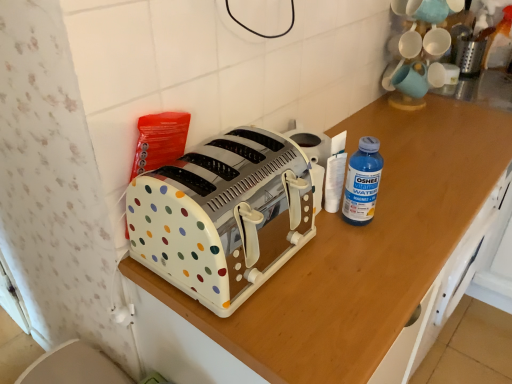
In order to face white polka dot plastic toaster at center, should I rotate leftwards or rightwards?

You should rotate left by 3.700 degrees.

This screenshot has width=512, height=384. What do you see at coordinates (362, 182) in the screenshot?
I see `blue plastic bottle at right` at bounding box center [362, 182].

Where is `white polka dot plastic toaster at center`? Image resolution: width=512 pixels, height=384 pixels. white polka dot plastic toaster at center is located at coordinates (223, 216).

Would you say blue plastic bottle at right contains metallic silver grater at upper right?

No, metallic silver grater at upper right is not a part of blue plastic bottle at right.

From their relative heights in the image, would you say blue plastic bottle at right is taller or shorter than metallic silver grater at upper right?

Considering their sizes, blue plastic bottle at right has more height than metallic silver grater at upper right.

In the scene shown: Considering the sizes of objects blue plastic bottle at right and metallic silver grater at upper right in the image provided, who is wider, blue plastic bottle at right or metallic silver grater at upper right?

metallic silver grater at upper right is wider.

Between blue plastic bottle at right and metallic silver grater at upper right, which one has smaller size?

With smaller size is blue plastic bottle at right.

Is the surface of white plastic toaster at center in direct contact with white polka dot plastic toaster at center?

No, white plastic toaster at center is not next to white polka dot plastic toaster at center.

From a real-world perspective, between white plastic toaster at center and white polka dot plastic toaster at center, who is vertically lower?

From a 3D spatial view, white plastic toaster at center is below.

Considering the relative sizes of white plastic toaster at center and white polka dot plastic toaster at center in the image provided, is white plastic toaster at center wider than white polka dot plastic toaster at center?

Yes.

Can you tell me how much blue plastic bottle at right and white polka dot plastic toaster at center differ in facing direction?

The angle between the facing direction of blue plastic bottle at right and the facing direction of white polka dot plastic toaster at center is 2.05 degrees.

From a real-world perspective, which is physically above, blue plastic bottle at right or white polka dot plastic toaster at center?

white polka dot plastic toaster at center is physically above.

Does blue plastic bottle at right appear on the left side of white polka dot plastic toaster at center?

In fact, blue plastic bottle at right is to the right of white polka dot plastic toaster at center.

Is white polka dot plastic toaster at center completely or partially inside blue plastic bottle at right?

No.

Between blue plastic bottle at right and white plastic toaster at center, which one has larger width?

With larger width is white plastic toaster at center.

How different are the orientations of blue plastic bottle at right and white plastic toaster at center in degrees?

The facing directions of blue plastic bottle at right and white plastic toaster at center are 0.64 degrees apart.

Which is more to the right, blue plastic bottle at right or white plastic toaster at center?

Positioned to the right is blue plastic bottle at right.

Could you tell me if blue plastic bottle at right is turned towards white plastic toaster at center?

No, blue plastic bottle at right is not facing towards white plastic toaster at center.

Is metallic silver grater at upper right next to blue plastic bottle at right?

metallic silver grater at upper right and blue plastic bottle at right are not in contact.

Considering the sizes of metallic silver grater at upper right and blue plastic bottle at right in the image, is metallic silver grater at upper right wider or thinner than blue plastic bottle at right?

Clearly, metallic silver grater at upper right has more width compared to blue plastic bottle at right.

Is point (456, 56) closer to viewer compared to point (376, 153)?

No, (456, 56) is further to viewer.

Considering the relative positions of metallic silver grater at upper right and blue plastic bottle at right in the image provided, is metallic silver grater at upper right to the right of blue plastic bottle at right from the viewer's perspective?

Correct, you'll find metallic silver grater at upper right to the right of blue plastic bottle at right.

Is metallic silver grater at upper right positioned behind white polka dot plastic toaster at center?

Yes, it is.

Between metallic silver grater at upper right and white polka dot plastic toaster at center, which one has larger size?

white polka dot plastic toaster at center.

Which object is positioned more to the right, metallic silver grater at upper right or white polka dot plastic toaster at center?

metallic silver grater at upper right is more to the right.

From their relative heights in the image, would you say metallic silver grater at upper right is taller or shorter than white polka dot plastic toaster at center?

Clearly, metallic silver grater at upper right is shorter compared to white polka dot plastic toaster at center.

Which is nearer, (138, 249) or (398, 115)?

Point (138, 249).

Is white polka dot plastic toaster at center aimed at white plastic toaster at center?

No, white polka dot plastic toaster at center is not facing towards white plastic toaster at center.

From a real-world perspective, is white polka dot plastic toaster at center located higher than white plastic toaster at center?

Yes, from a real-world perspective, white polka dot plastic toaster at center is above white plastic toaster at center.

Locate an element on the screen. appliance that appears on the right of blue plastic bottle at right is located at coordinates (469, 54).

Where is `toaster on the left side of white plastic toaster at center`? The image size is (512, 384). toaster on the left side of white plastic toaster at center is located at coordinates (223, 216).

From the image, which object appears to be farther from white plastic toaster at center, blue plastic bottle at right or white polka dot plastic toaster at center?

Based on the image, blue plastic bottle at right appears to be further to white plastic toaster at center.

When comparing their distances from white polka dot plastic toaster at center, does white plastic toaster at center or metallic silver grater at upper right seem further?

metallic silver grater at upper right is further to white polka dot plastic toaster at center.

Looking at the image, which one is located closer to white plastic toaster at center, white polka dot plastic toaster at center or blue plastic bottle at right?

The object closer to white plastic toaster at center is white polka dot plastic toaster at center.

From the image, which object appears to be farther from blue plastic bottle at right, white polka dot plastic toaster at center or white plastic toaster at center?

white plastic toaster at center.

Based on their spatial positions, is white plastic toaster at center or blue plastic bottle at right further from metallic silver grater at upper right?

blue plastic bottle at right.

When comparing their distances from white polka dot plastic toaster at center, does metallic silver grater at upper right or white plastic toaster at center seem further?

metallic silver grater at upper right.

Based on their spatial positions, is blue plastic bottle at right or white polka dot plastic toaster at center closer to metallic silver grater at upper right?

blue plastic bottle at right is closer to metallic silver grater at upper right.

Looking at this image, when comparing their distances from white polka dot plastic toaster at center, does blue plastic bottle at right or metallic silver grater at upper right seem further?

metallic silver grater at upper right is further to white polka dot plastic toaster at center.

The height and width of the screenshot is (384, 512). Find the location of `toaster that lies between blue plastic bottle at right and white plastic toaster at center from top to bottom`. toaster that lies between blue plastic bottle at right and white plastic toaster at center from top to bottom is located at coordinates (223, 216).

Where is `bottle positioned between white polka dot plastic toaster at center and metallic silver grater at upper right from near to far`? This screenshot has height=384, width=512. bottle positioned between white polka dot plastic toaster at center and metallic silver grater at upper right from near to far is located at coordinates tap(362, 182).

Locate an element on the screen. The width and height of the screenshot is (512, 384). bottle positioned between white plastic toaster at center and metallic silver grater at upper right from near to far is located at coordinates (362, 182).

I want to click on toaster between white plastic toaster at center and metallic silver grater at upper right along the z-axis, so click(x=223, y=216).